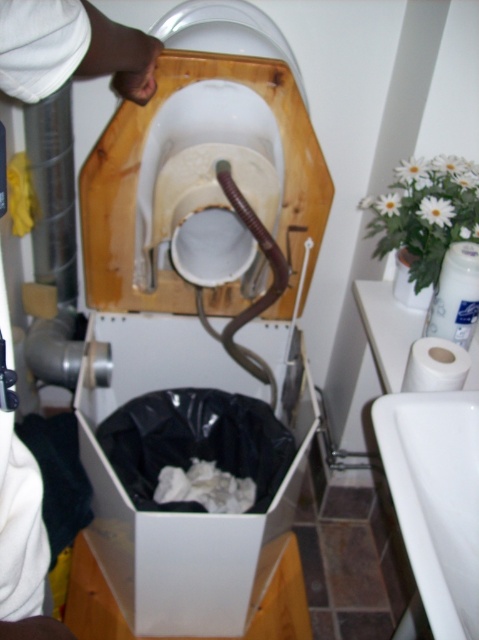
You are a plumber working on the toilet and need to place a tool in the white plastic box at lower center. Where exactly should you place it?

The white plastic box at lower center is located at coordinates point (180, 513), so place the tool there.

You are a plumber inspecting the bathroom and need to access the white glossy sink at lower right and the white matte toilet paper at lower right. Which object is closer to the center of the bathroom?

The white glossy sink at lower right is closer to the center of the bathroom because it is positioned to the left of the white matte toilet paper at lower right, which is further to the right.

You are standing in the bathroom and need to wash your hands. Where is the white glossy sink at lower right located?

The white glossy sink at lower right is located at point (435, 499).